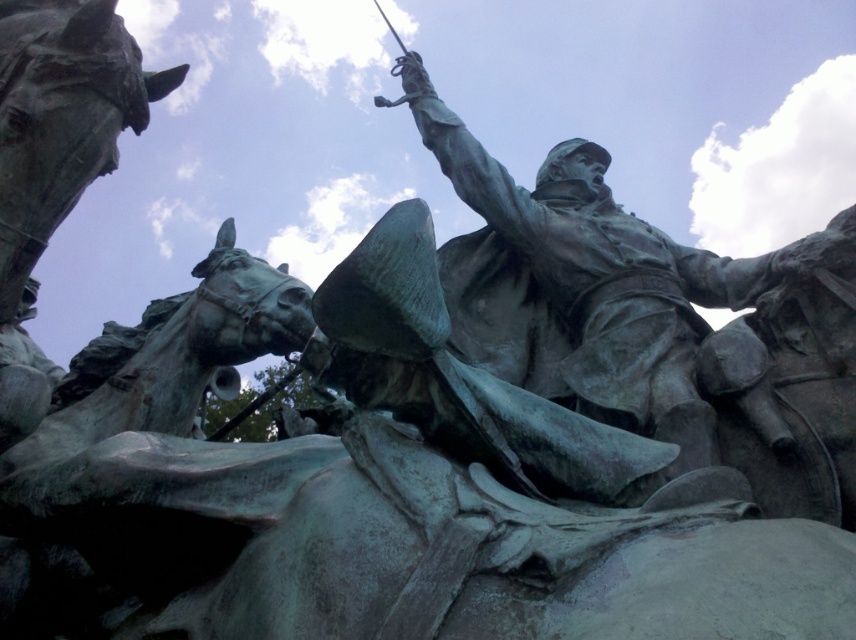
Can you confirm if green patina statue at center is positioned to the left of green patina horse at upper left?

In fact, green patina statue at center is to the right of green patina horse at upper left.

Who is positioned more to the right, green patina statue at center or green patina horse at upper left?

Positioned to the right is green patina statue at center.

You are a GUI agent. You are given a task and a screenshot of the screen. Output one action in this format:
    pyautogui.click(x=<x>, y=<y>)
    Task: Click on the green patina statue at center
    This screenshot has width=856, height=640.
    Given the screenshot: What is the action you would take?
    [611, 288]